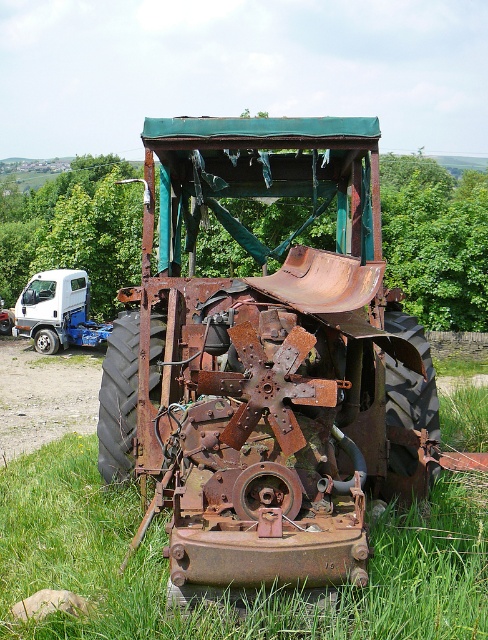
Question: Which point is farther to the camera?

Choices:
 (A) (83, 337)
 (B) (238, 556)

Answer: (A)

Question: Among these objects, which one is farthest from the camera?

Choices:
 (A) white matte truck at left
 (B) rusty metal tractor at center

Answer: (A)

Question: Is rusty metal tractor at center closer to camera compared to white matte truck at left?

Choices:
 (A) no
 (B) yes

Answer: (B)

Question: Is rusty metal tractor at center above white matte truck at left?

Choices:
 (A) no
 (B) yes

Answer: (A)

Question: Is rusty metal tractor at center smaller than white matte truck at left?

Choices:
 (A) no
 (B) yes

Answer: (B)

Question: Which point is closer to the camera?

Choices:
 (A) rusty metal tractor at center
 (B) white matte truck at left

Answer: (A)